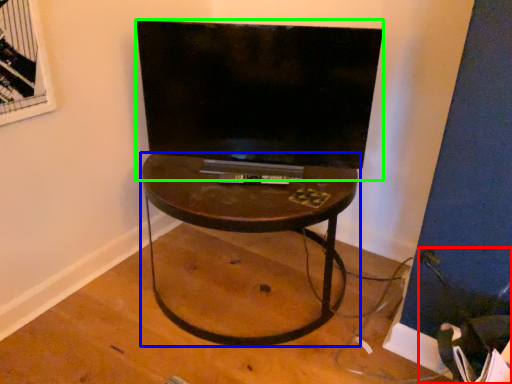
Question: Considering the real-world distances, which object is closest to swivel chair (highlighted by a red box)? table (highlighted by a blue box) or television (highlighted by a green box).

Choices:
 (A) table
 (B) television

Answer: (A)